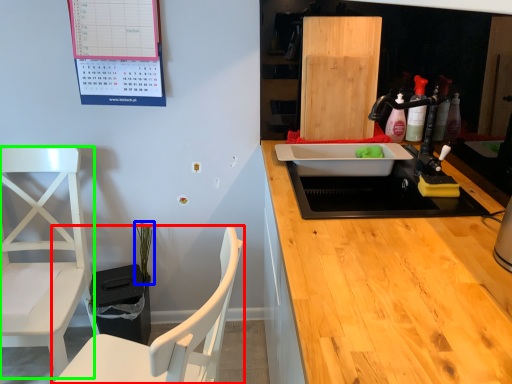
Question: Which object is positioned closest to chair (highlighted by a red box)? Select from plant (highlighted by a blue box) and chair (highlighted by a green box).

Choices:
 (A) plant
 (B) chair

Answer: (B)